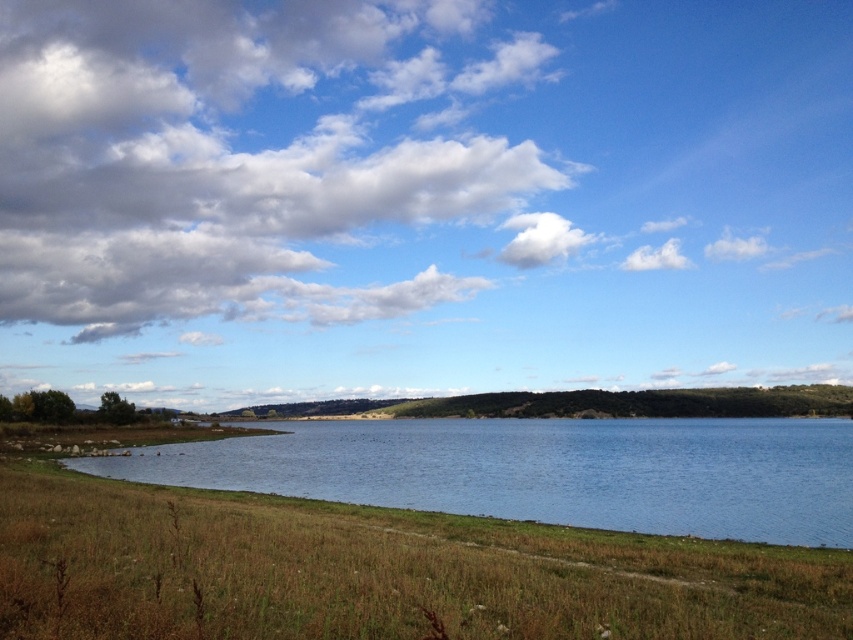
You are standing on the lakeshore and looking at the blue water at center and the white fluffy cloud at upper center. Which object takes up more space in the image?

The blue water at center takes up more space in the image than the white fluffy cloud at upper center because it is larger in size.

You are a drone operator planning to fly a drone from the blue water at center to the white fluffy cloud at upper center. Given that the drone can only travel 250 meters before needing a battery recharge, will you be able to reach the cloud without recharging?

The blue water at center and white fluffy cloud at upper center are 262.30 meters apart from each other. Since the distance exceeds the drone battery range of 250 meters, the drone cannot reach the cloud without recharging.

You are standing at the lakeside and want to take a photo of the dry grass at lower center and the white fluffy cloud at upper center in the same frame. Considering the distance between them, will you need to adjust your camera settings to focus on both objects simultaneously?

The dry grass at lower center is 409.92 meters away from the white fluffy cloud at upper center. Since the distance between them is significant, you will need to adjust your camera settings to ensure both are in focus, possibly by using a smaller aperture for greater depth of field.